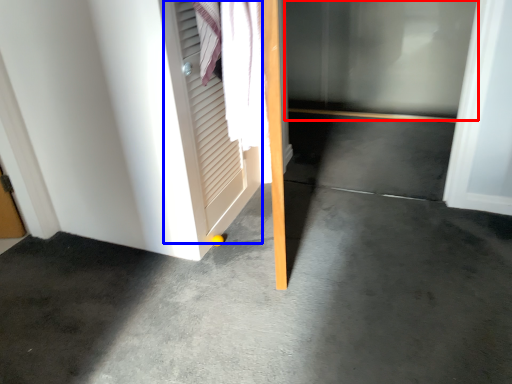
Question: Among these objects, which one is farthest to the camera, glass door (highlighted by a red box) or screen door (highlighted by a blue box)?

Choices:
 (A) glass door
 (B) screen door

Answer: (A)